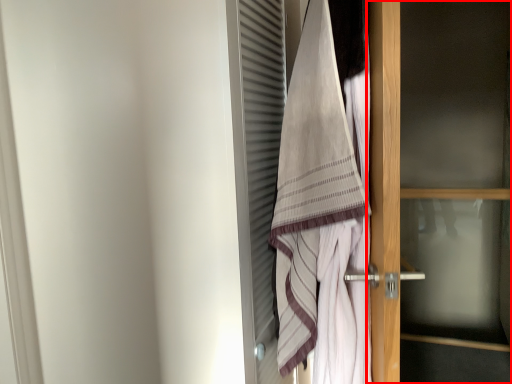
Question: From the image's perspective, what is the correct spatial positioning of door (annotated by the red box) in reference to towel?

Choices:
 (A) above
 (B) below

Answer: (B)